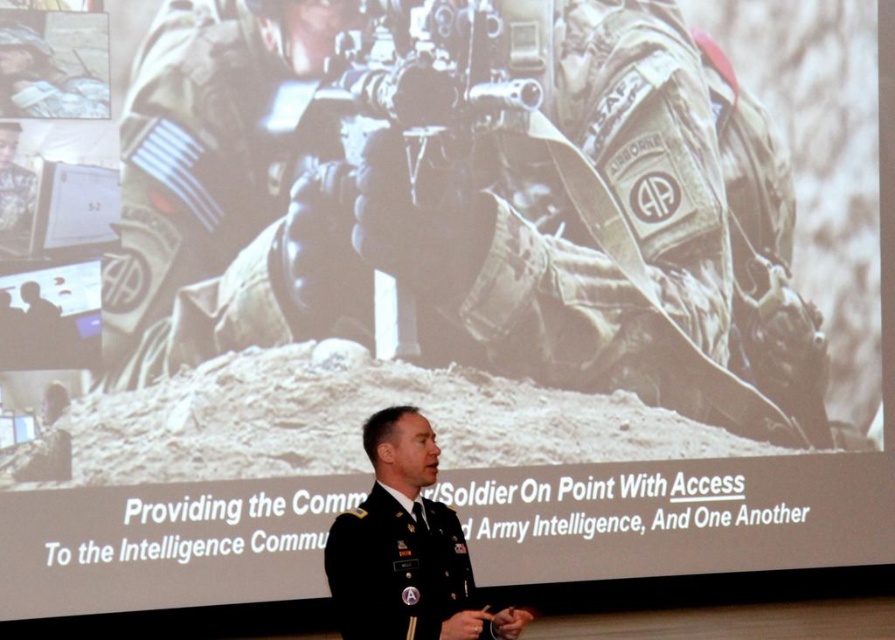
You are a military trainee attending the presentation. You notice the matte black rifle at center and the black uniform at center. Which object is wider?

The matte black rifle at center might be wider than black uniform at center.

You are a photographer who needs to capture a closeup shot of the black uniform at center without the matte black rifle at center appearing in the frame. Is this possible given their positions?

The matte black rifle at center is positioned on the left side of black uniform at center. Since the rifle is to the left of the uniform, you can move your camera to the right side of the uniform to frame the shot without including the rifle.

Consider the image. You are a military recruit attending the presentation. You notice two items at the center of the screen. Which item is taller, the matte black rifle at center or the black uniform at center?

The matte black rifle at center has a greater height compared to the black uniform at center, so the matte black rifle at center is taller.